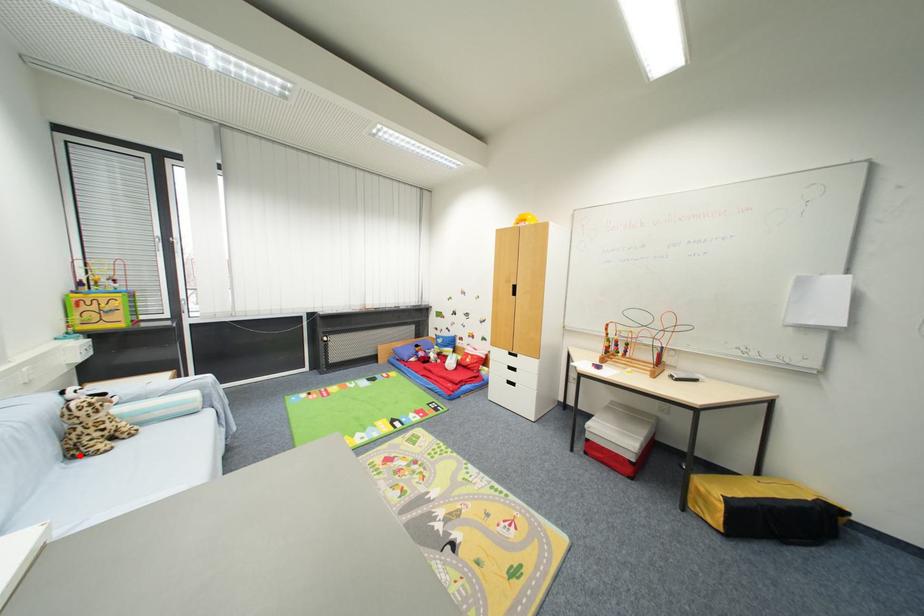
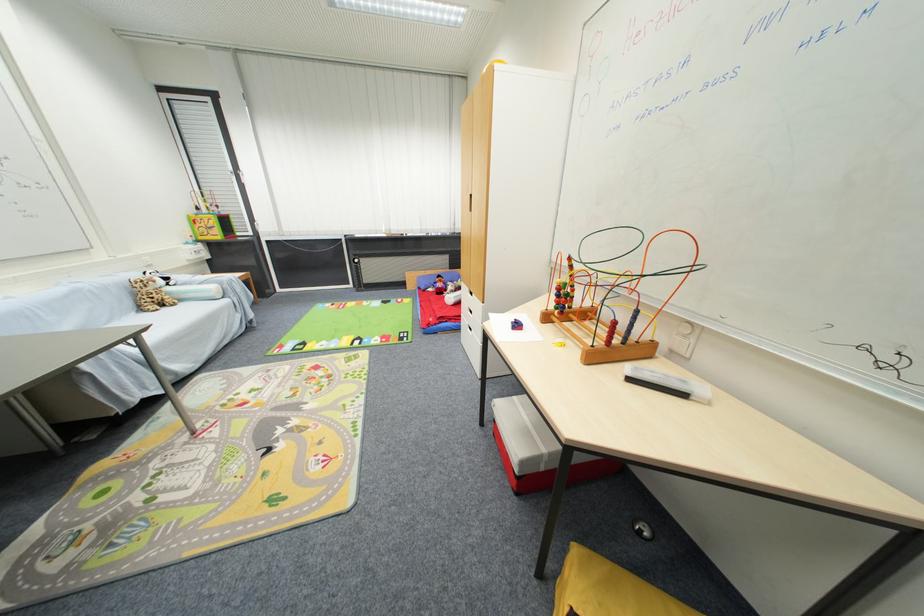
The point at the highlighted location is marked in the first image. Where is the corresponding point in the second image?

(146, 310)